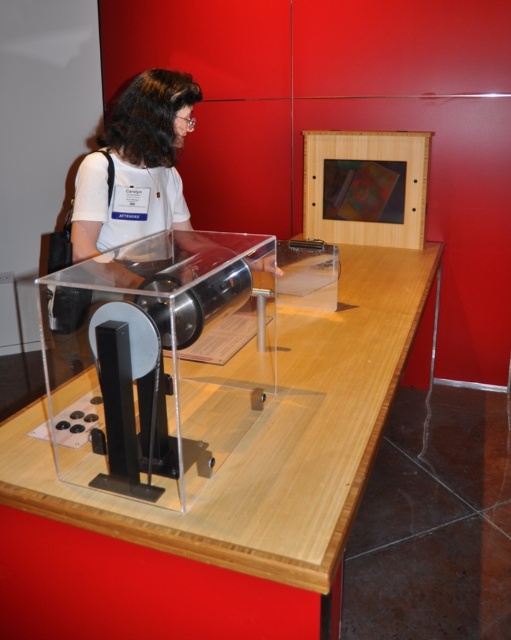
Question: Which of the following is the closest to the observer?

Choices:
 (A) (94, 161)
 (B) (190, 573)

Answer: (B)

Question: Does wooden table at center appear over matte white shirt at center?

Choices:
 (A) yes
 (B) no

Answer: (B)

Question: Which point is farther from the camera taking this photo?

Choices:
 (A) (128, 205)
 (B) (17, 556)

Answer: (A)

Question: Observing the image, what is the correct spatial positioning of wooden table at center in reference to matte white shirt at center?

Choices:
 (A) left
 (B) right

Answer: (B)

Question: Can you confirm if wooden table at center is positioned above matte white shirt at center?

Choices:
 (A) yes
 (B) no

Answer: (B)